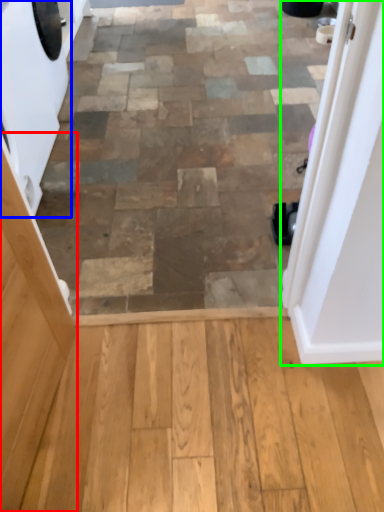
Question: Which object is positioned closest to screen door (highlighted by a red box)? Select from washing machine (highlighted by a blue box) and door (highlighted by a green box).

Choices:
 (A) washing machine
 (B) door

Answer: (B)